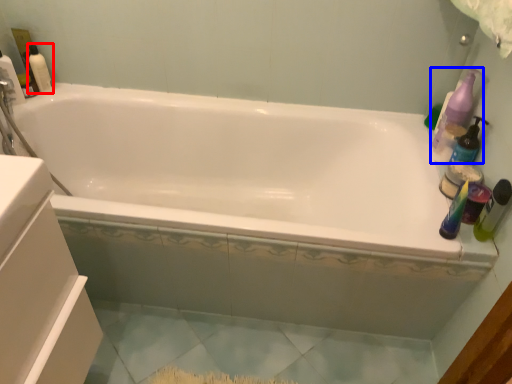
Question: Among these objects, which one is nearest to the camera, cleaning product (highlighted by a red box) or cleaning product (highlighted by a blue box)?

Choices:
 (A) cleaning product
 (B) cleaning product

Answer: (B)